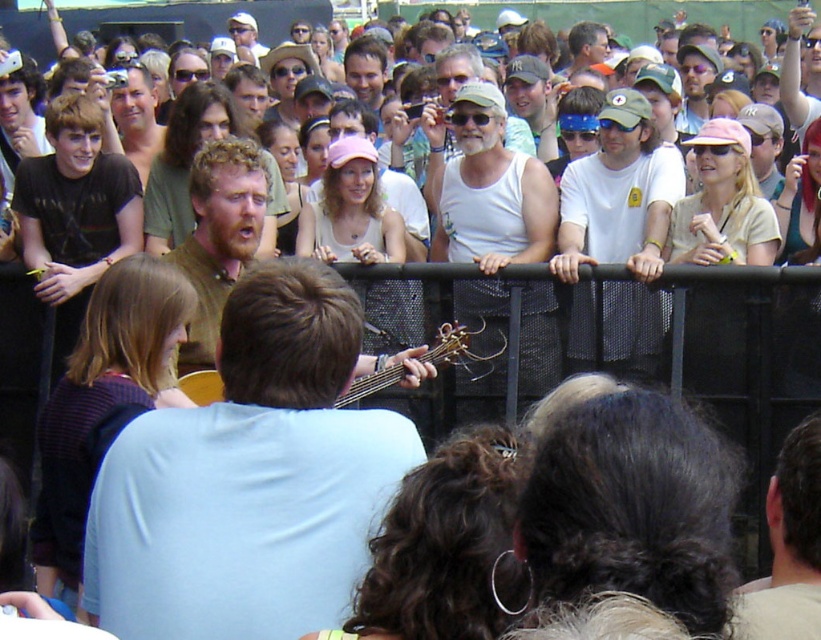
You are standing in the crowd at the music festival and want to move forward to get a better view of the performer. There are two points marked on the ground ahead of you. The first point is at coordinates point (x=232, y=236) and the second point is at point (x=322, y=202). Which point is closer to you?

Point (x=232, y=236) is closer to the viewer than point (x=322, y=202), so the first point is closer to you.

You are a photographer at the music festival. You need to capture a photo that includes both the brownwoolshirt at center and the matte white tank top at center. Which one should you position on the left side of the frame to include both in the shot?

To include both the brownwoolshirt at center and the matte white tank top at center in the shot, position the brownwoolshirt at center on the left side of the frame since it is already to the left of the matte white tank top at center.

You are a photographer at the music festival. You want to take a photo of the performer. The brown wood guitar at center and the brownwoolshirt at center are both in the frame. Which object is closer to the camera?

The brown wood guitar at center is positioned under the brownwoolshirt at center, so the brownwoolshirt at center is closer to the camera since it is above the guitar.